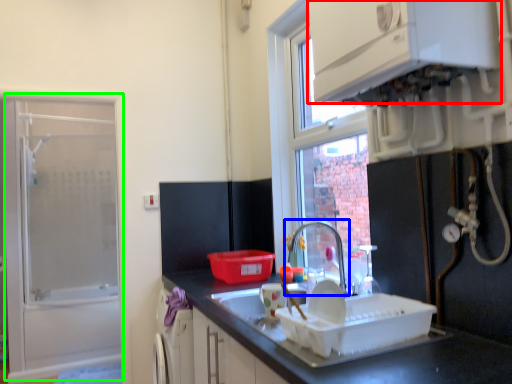
Question: Which object is positioned closest to cabinetry (highlighted by a red box)? Select from tap (highlighted by a blue box) and screen door (highlighted by a green box).

Choices:
 (A) tap
 (B) screen door

Answer: (A)